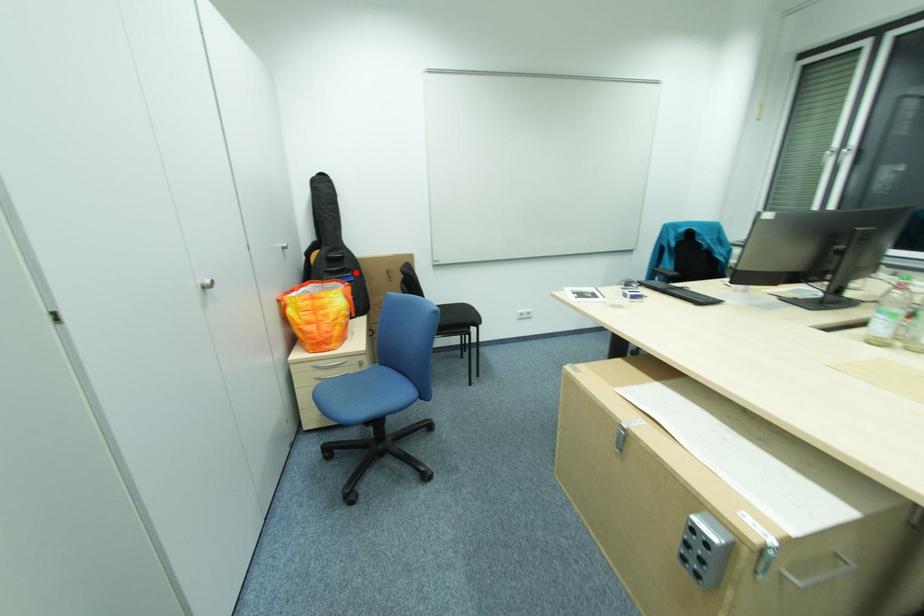
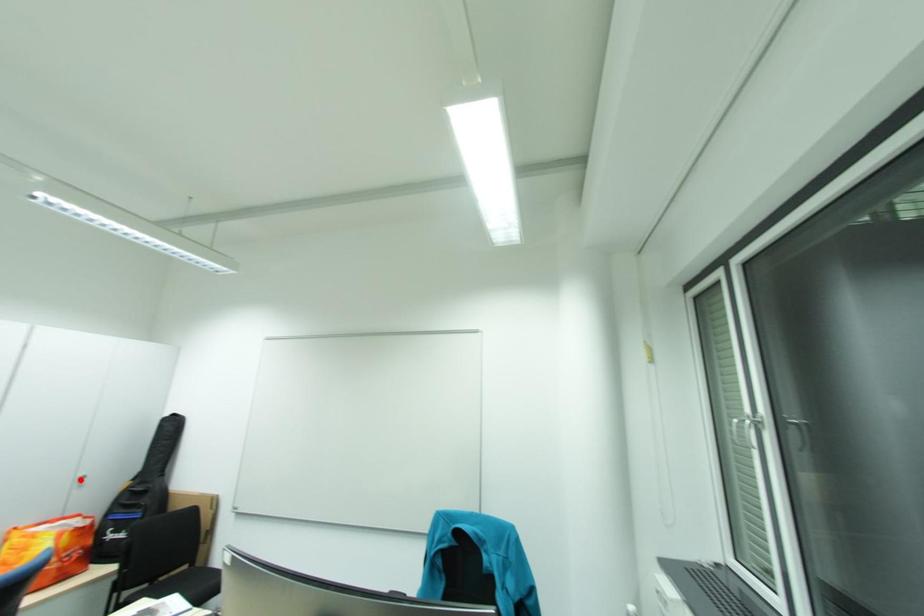
I am providing you with two images of the same scene from different viewpoints. A red point is marked on the first image and another point is marked on the second image. Do the highlighted points in image1 and image2 indicate the same real-world spot?

No